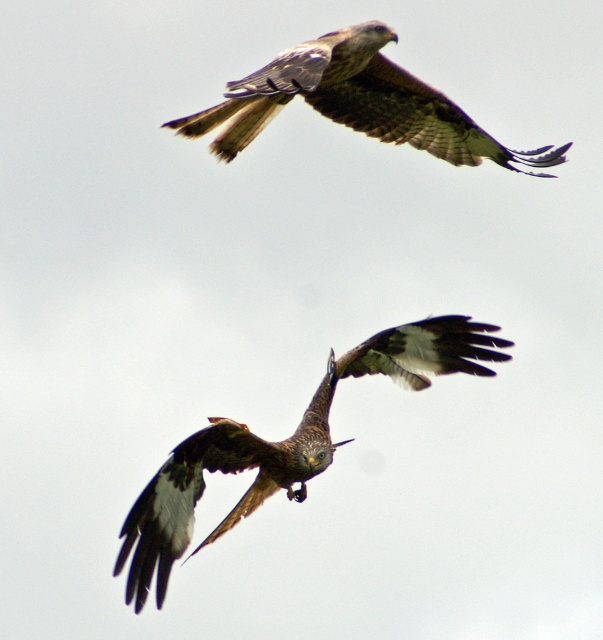
Which of these two, brown speckled eagle at center or brown feathered eagle at upper center, stands shorter?

brown feathered eagle at upper center

Between point (373, 349) and point (282, 104), which one is positioned in front?

Point (373, 349) is more forward.

The height and width of the screenshot is (640, 603). In order to click on brown speckled eagle at center in this screenshot , I will do tap(283, 444).